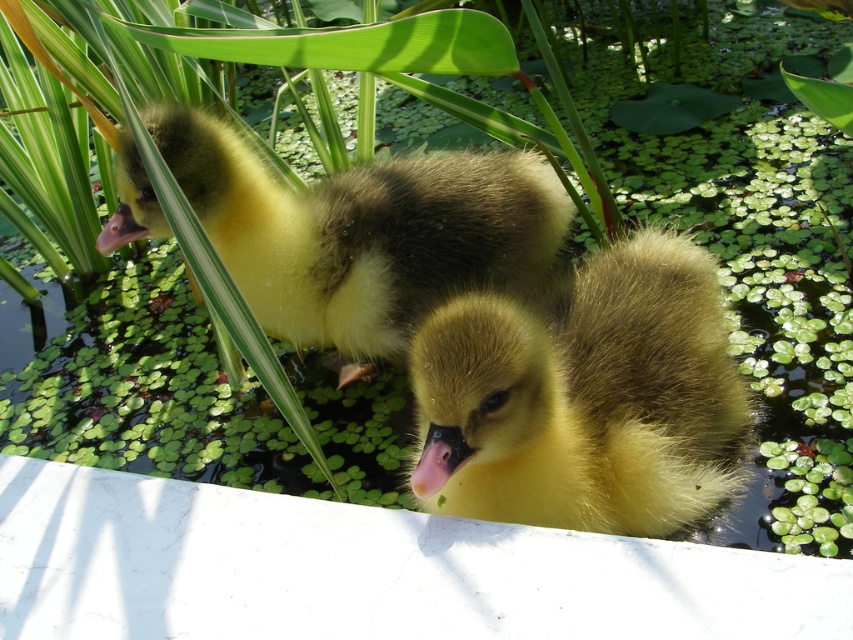
In the scene shown: You are observing two ducklings in the pond. Which duckling, the yellow fluffy duckling at center or the yellow downy duckling at center, is smaller in size?

The yellow fluffy duckling at center is smaller in size compared to the yellow downy duckling at center.

You are a photographer trying to capture the perfect shot of the yellow fluffy duckling at center. Based on its position in the scene, what coordinates should you aim your camera at to ensure the duckling is centered in your frame?

The yellow fluffy duckling at center is located at coordinates point (584,397), so aiming your camera at those coordinates will center the duckling in your frame.

You are observing two ducklings in the pond. The scene has a white ledge in the foreground. Which duckling is closer to the right edge of the white ledge? The options are the yellow fluffy duckling at center and the yellow downy duckling at center.

The yellow fluffy duckling at center is to the right of the yellow downy duckling at center, so it is closer to the right edge of the white ledge.